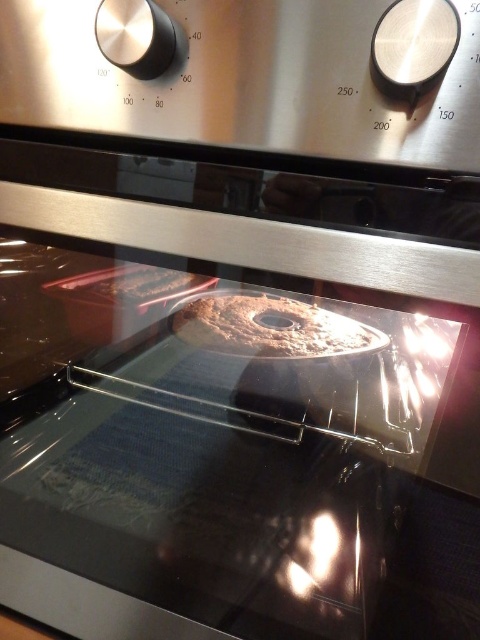
Question: Is golden brown doughnut at center to the right of matte brown tray at left from the viewer's perspective?

Choices:
 (A) no
 (B) yes

Answer: (B)

Question: Which object is farther from the camera taking this photo?

Choices:
 (A) golden brown doughnut at center
 (B) matte brown tray at left
 (C) brushed metal oven knobs at upper center

Answer: (B)

Question: Which point is farther to the camera?

Choices:
 (A) matte brown tray at left
 (B) brushed metal oven knobs at upper center

Answer: (A)

Question: Can you confirm if brushed metal oven knobs at upper center is positioned above golden brown doughnut at center?

Choices:
 (A) no
 (B) yes

Answer: (B)

Question: Which of the following is the closest to the observer?

Choices:
 (A) (230, 349)
 (B) (120, 291)
 (C) (85, 115)

Answer: (C)

Question: In this image, where is golden brown doughnut at center located relative to matte brown tray at left?

Choices:
 (A) above
 (B) below

Answer: (B)